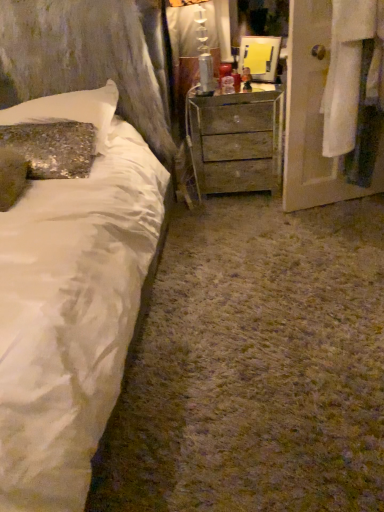
Question: From the image's perspective, is white satin bed at left positioned above or below sparkly sequin pillow at upper left?

Choices:
 (A) above
 (B) below

Answer: (B)

Question: From a real-world perspective, is white satin bed at left above or below sparkly sequin pillow at upper left?

Choices:
 (A) above
 (B) below

Answer: (B)

Question: Estimate the real-world distances between objects in this image. Which object is closer to the wooden chest of drawers at center?

Choices:
 (A) white satin bed at left
 (B) sparkly sequin pillow at upper left
 (C) white fabric door at right

Answer: (C)

Question: Considering the real-world distances, which object is closest to the wooden chest of drawers at center?

Choices:
 (A) sparkly sequin pillow at upper left
 (B) white fabric door at right
 (C) white satin bed at left

Answer: (B)